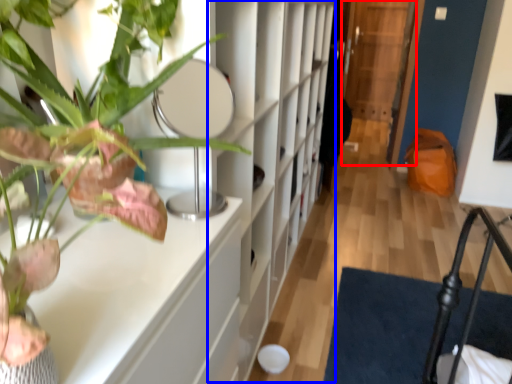
Question: Which point is closer to the camera, glass door (highlighted by a red box) or bookshelf (highlighted by a blue box)?

Choices:
 (A) glass door
 (B) bookshelf

Answer: (B)